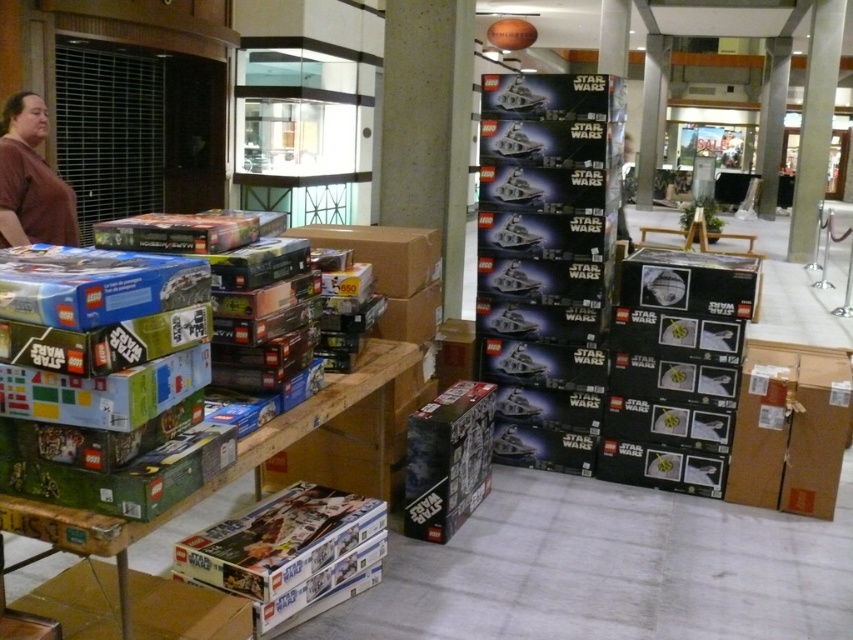
In the scene shown: Between brown cardboard box at lower right and brown matte shirt at left, which one has more height?

Standing taller between the two is brown matte shirt at left.

Is brown cardboard box at lower right to the right of brown matte shirt at left from the viewer's perspective?

Indeed, brown cardboard box at lower right is positioned on the right side of brown matte shirt at left.

Is point (743, 499) in front of point (28, 161)?

Yes, it is.

What are the coordinates of `brown cardboard box at lower right` in the screenshot? It's located at (790, 428).